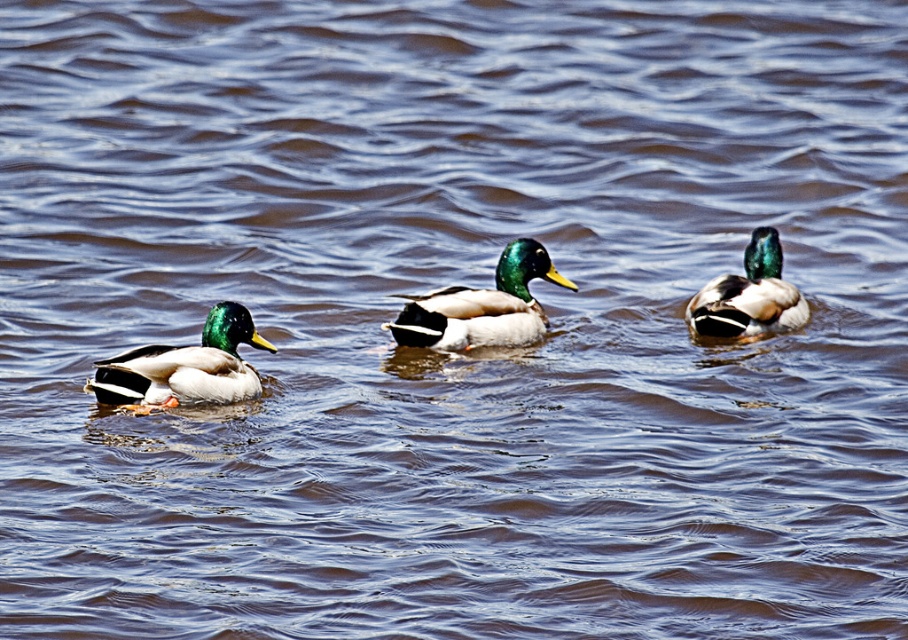
At what (x,y) coordinates should I click in order to perform the action: click on shiny green drake at left. Please return your answer as a coordinate pair (x, y). The width and height of the screenshot is (908, 640). Looking at the image, I should click on (185, 365).

Who is shorter, shiny green drake at left or green glossy duck at center?

Standing shorter between the two is shiny green drake at left.

Locate an element on the screen. shiny green drake at left is located at coordinates (185, 365).

Does green glossy duck at center have a lesser width compared to shiny green head at right?

No.

Can you confirm if green glossy duck at center is taller than shiny green head at right?

No.

Which is in front, point (422, 301) or point (743, 317)?

Point (422, 301)

Where is `green glossy duck at center`? The height and width of the screenshot is (640, 908). green glossy duck at center is located at coordinates (482, 307).

The image size is (908, 640). What do you see at coordinates (185, 365) in the screenshot?
I see `shiny green drake at left` at bounding box center [185, 365].

In the scene shown: Which is above, shiny green drake at left or shiny green head at right?

shiny green head at right is higher up.

Which is behind, point (153, 371) or point (778, 266)?

The point (778, 266) is more distant.

Where is `shiny green drake at left`? The image size is (908, 640). shiny green drake at left is located at coordinates (x=185, y=365).